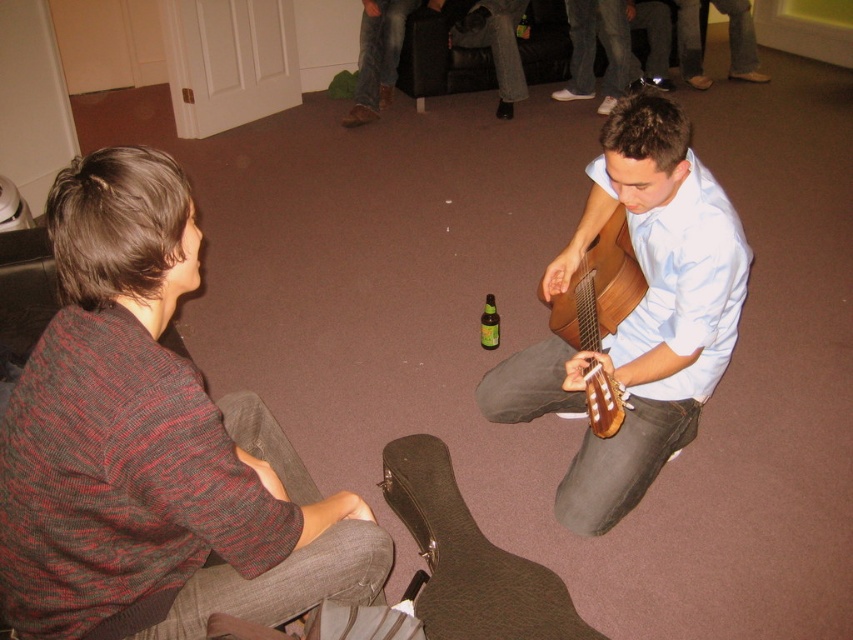
You are a photographer trying to capture the perfect shot of the two people in the scene. You want to ensure that both the wooden guitar at center and the wooden acoustic guitar at center are clearly visible in your photo. Based on their positions, which guitar should you focus on first to make sure it appears in the foreground?

The wooden guitar at center should be focused on first because it is positioned above the wooden acoustic guitar at center, meaning it is closer to the camera and thus in the foreground.

You are a photographer setting up a camera to capture the scene. The camera is positioned at eye level with the seated individual. Since the wooden guitar at center and the light blue shirt at center are both in the frame, which object will appear taller in the photo?

The wooden guitar at center will appear taller in the photo because it has a greater height compared to the light blue shirt at center according to the description.

You are standing in the living room scene and want to place a small plant between the two points labeled as point (619,464) and point (614,268). Which point should the plant be closer to in order to be nearer to the viewer?

The plant should be placed closer to point (619,464) because it is closer to the viewer compared to point (614,268).